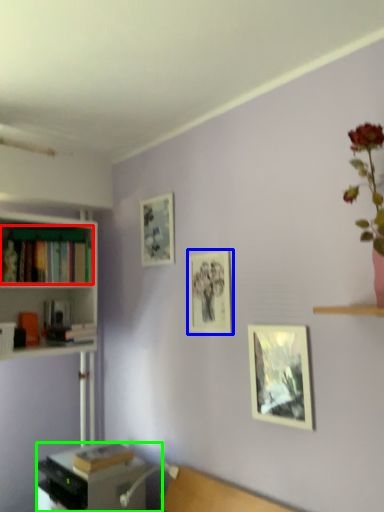
Question: Based on their relative distances, which object is farther from book (highlighted by a red box)? Choose from picture frame (highlighted by a blue box) and desk (highlighted by a green box).

Choices:
 (A) picture frame
 (B) desk

Answer: (B)